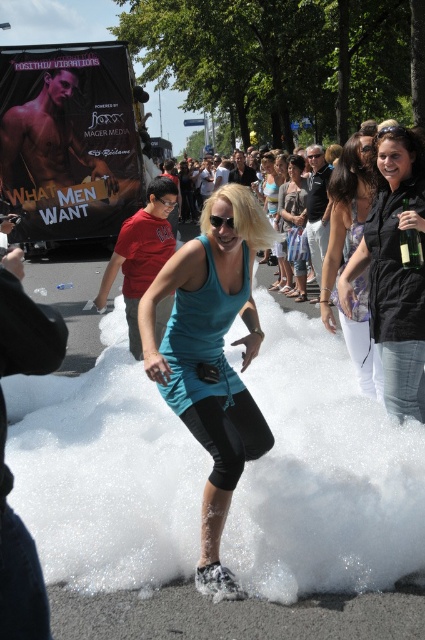
Question: Which object appears farthest from the camera in this image?

Choices:
 (A) matte black tank top at center
 (B) white foamy substance at center
 (C) black plastic goggles at center

Answer: (A)

Question: Does light purple sheer blouse at center appear under clear glass bottle at center?

Choices:
 (A) no
 (B) yes

Answer: (A)

Question: Is teal fabric tank top at center positioned in front of light purple sheer blouse at center?

Choices:
 (A) no
 (B) yes

Answer: (B)

Question: Which point is farther to the camera?

Choices:
 (A) (407, 211)
 (B) (300, 294)
 (C) (368, 157)
 (D) (314, 152)

Answer: (B)

Question: Which point appears farthest from the camera in this image?

Choices:
 (A) (413, 243)
 (B) (272, 196)
 (C) (209, 218)

Answer: (B)

Question: Can you confirm if transparent plastic goggles at center is wider than black plastic goggles at center?

Choices:
 (A) yes
 (B) no

Answer: (B)